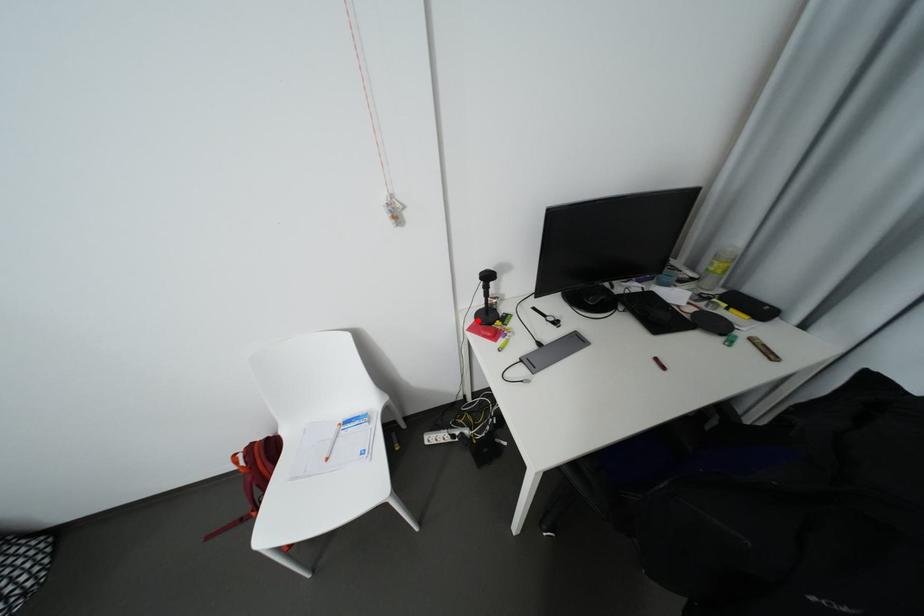
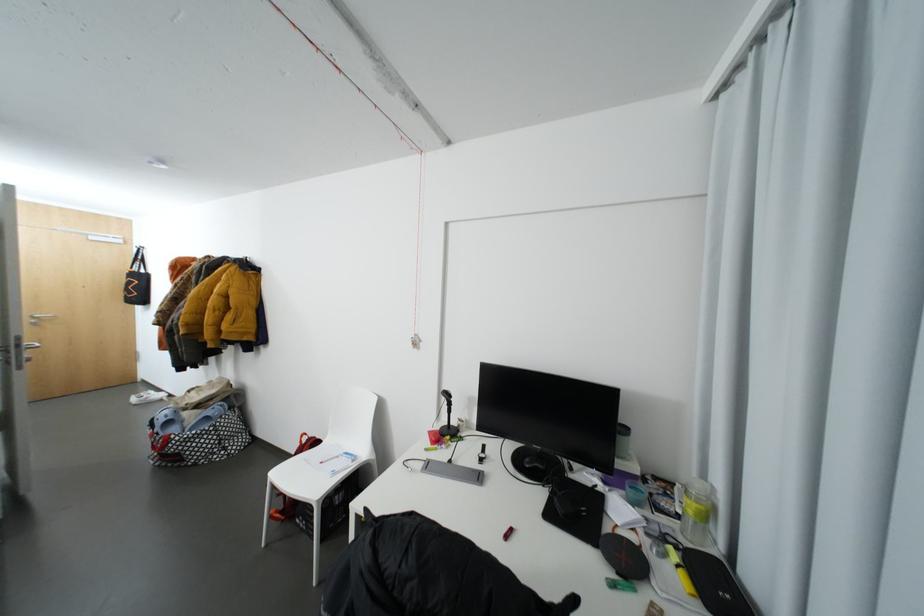
In the second image, find the point that corresponds to the highlighted location in the first image.

(444, 428)